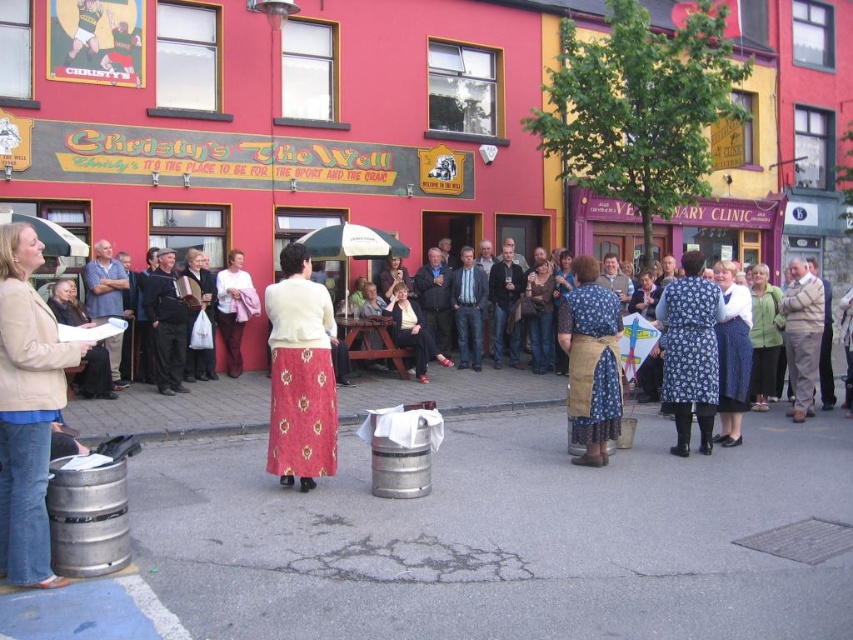
Between blue floral dress at center and dark brown leather jacket at center, which one appears on the right side from the viewer's perspective?

blue floral dress at center

Between point (718, 339) and point (115, 316), which one is positioned in front?

Positioned in front is point (718, 339).

Is point (741, 387) positioned behind point (119, 384)?

No.

The width and height of the screenshot is (853, 640). Find the location of `blue floral dress at center`. blue floral dress at center is located at coordinates [732, 355].

Is blue floral dress at center positioned in front of brown wool sweater at center?

Yes, it is in front of brown wool sweater at center.

Which is more to the left, blue floral dress at center or brown wool sweater at center?

blue floral dress at center

Does point (720, 358) come in front of point (819, 353)?

Yes, point (720, 358) is closer to viewer.

Identify the location of blue floral dress at center. This screenshot has width=853, height=640. (732, 355).

Which is in front, point (6, 296) or point (614, 410)?

Point (6, 296)

Is denim jacket at lower left bigger than floral fabric apron at center?

No.

Between point (7, 428) and point (576, 285), which one is positioned behind?

Positioned behind is point (576, 285).

I want to click on denim jacket at lower left, so click(27, 410).